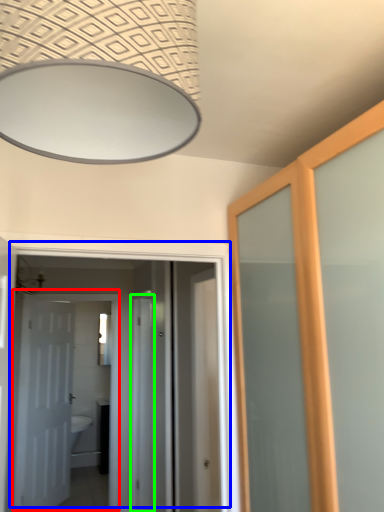
Question: Considering the real-world distances, which object is closest to door (highlighted by a red box)? door (highlighted by a blue box) or screen door (highlighted by a green box).

Choices:
 (A) door
 (B) screen door

Answer: (A)